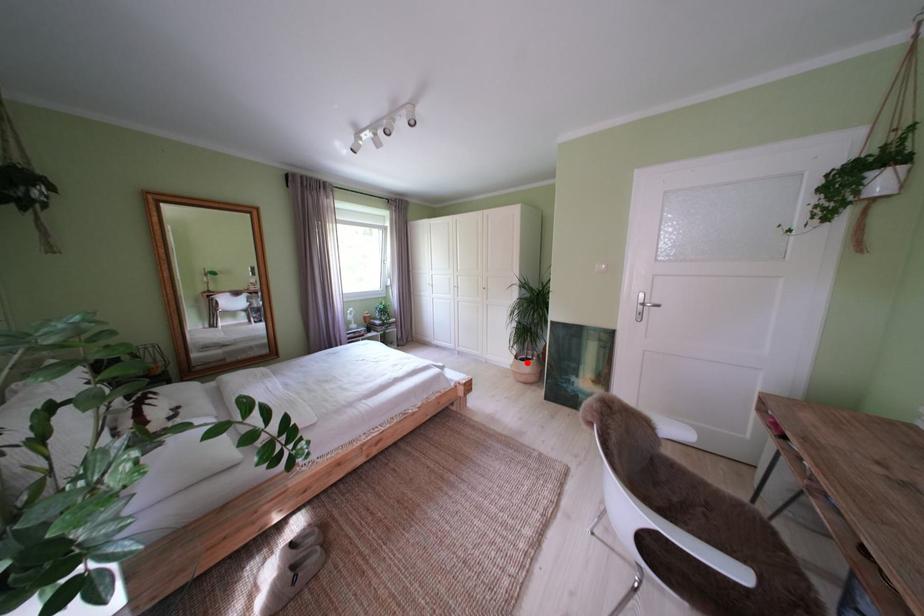
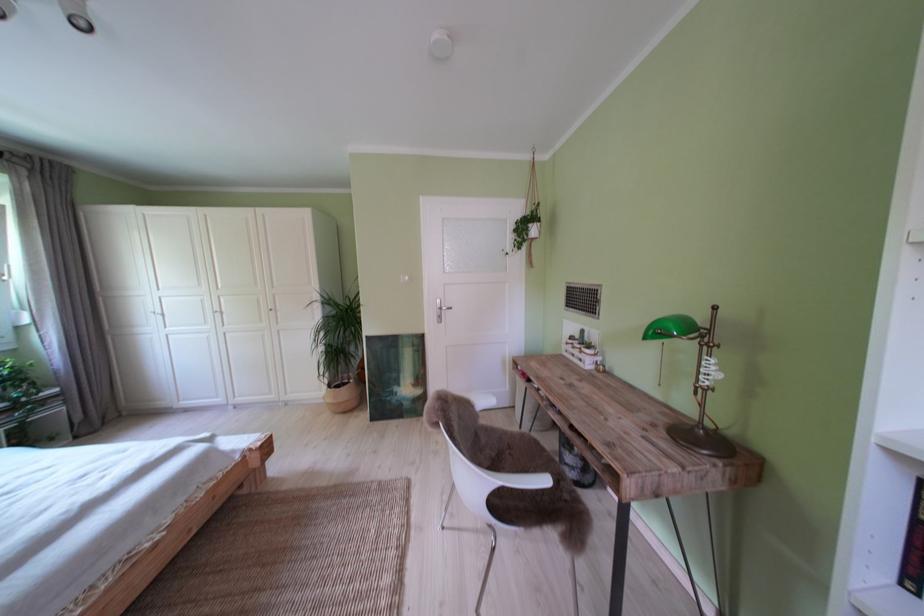
Question: I am providing you with two images of the same scene from different viewpoints. A red point is shown in image1. For the corresponding object point in image2, is it positioned nearer or farther from the camera?

Choices:
 (A) Nearer
 (B) Farther

Answer: (A)